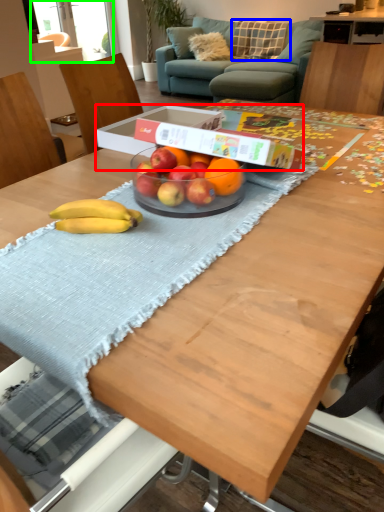
Question: Which object is the closest to the cardboard box (highlighted by a red box)? Choose among these: pillow (highlighted by a blue box) or window screen (highlighted by a green box).

Choices:
 (A) pillow
 (B) window screen

Answer: (B)